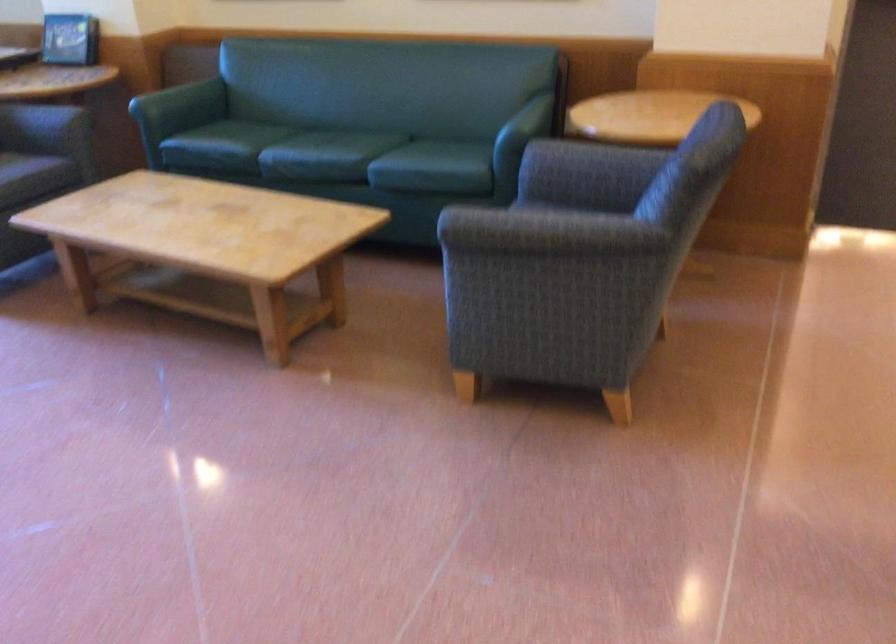
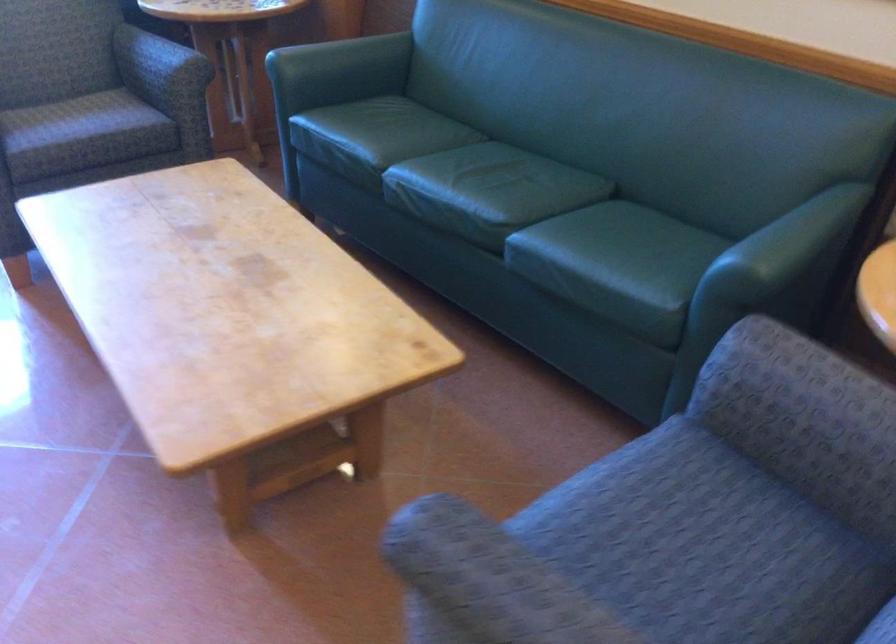
The point at (573, 162) is marked in the first image. Where is the corresponding point in the second image?

(796, 404)